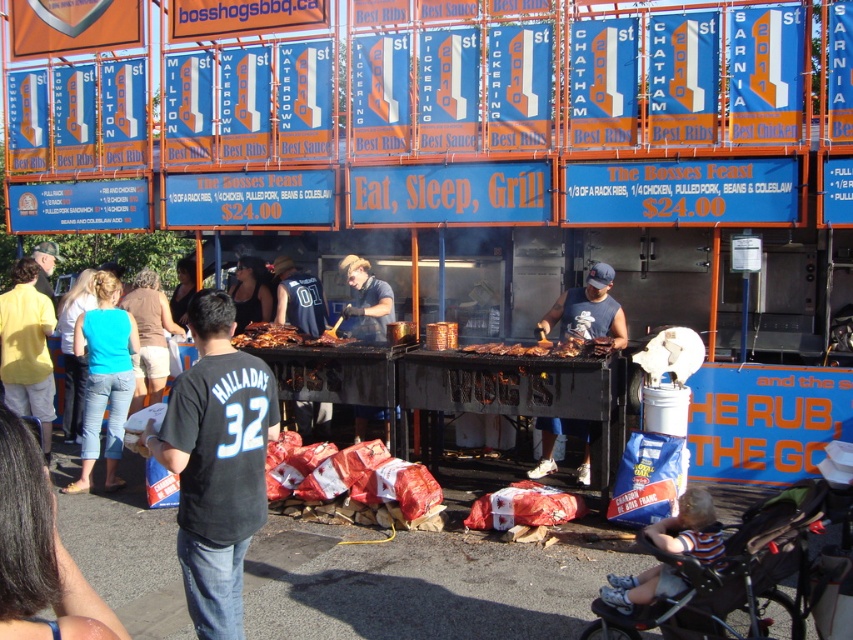
Between black jersey at center and dark blue sleeveless shirt at center, which one appears on the right side from the viewer's perspective?

From the viewer's perspective, dark blue sleeveless shirt at center appears more on the right side.

Who is more distant from viewer, (x=196, y=589) or (x=544, y=321)?

The point (x=544, y=321) is more distant.

The image size is (853, 640). What are the coordinates of `black jersey at center` in the screenshot? It's located at (216, 461).

Where is `black jersey at center`? This screenshot has width=853, height=640. black jersey at center is located at coordinates (216, 461).

Is black jersey at center to the left of golden crispy ribs at center from the viewer's perspective?

No, black jersey at center is not to the left of golden crispy ribs at center.

Can you confirm if black jersey at center is positioned below golden crispy ribs at center?

Yes, black jersey at center is below golden crispy ribs at center.

Which is behind, point (228, 419) or point (322, 342)?

Point (322, 342)

Where is `black jersey at center`? The image size is (853, 640). black jersey at center is located at coordinates (216, 461).

Can you confirm if dark blue shirt at center is smaller than golden crispy ribs at center?

Indeed, dark blue shirt at center has a smaller size compared to golden crispy ribs at center.

Consider the image. Can you confirm if dark blue shirt at center is taller than golden crispy ribs at center?

Correct, dark blue shirt at center is much taller as golden crispy ribs at center.

Where is `dark blue shirt at center`? dark blue shirt at center is located at coordinates (364, 301).